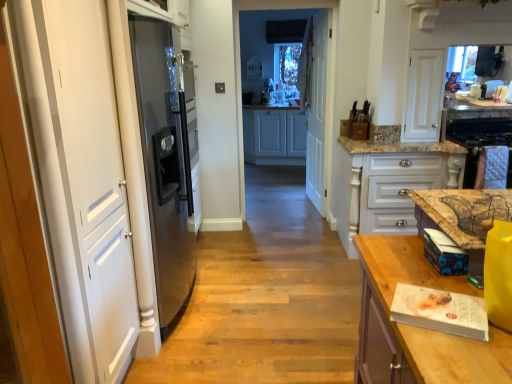
Question: Does white wood cabinets at center, which appears as the 2th cabinetry when viewed from the front, appear on the right side of brown marble countertop at right, the 1th countertop positioned from the top?

Choices:
 (A) yes
 (B) no

Answer: (B)

Question: Is white wood cabinets at center, the first cabinetry viewed from the left, touching brown marble countertop at right, which is the 2th countertop in bottom-to-top order?

Choices:
 (A) yes
 (B) no

Answer: (B)

Question: Considering the relative sizes of white wood cabinets at center, the first cabinetry viewed from the left, and brown marble countertop at right, the 1th countertop positioned from the top, in the image provided, is white wood cabinets at center, the first cabinetry viewed from the left, thinner than brown marble countertop at right, the 1th countertop positioned from the top,?

Choices:
 (A) yes
 (B) no

Answer: (B)

Question: Is white wood cabinets at center, which appears as the second cabinetry when viewed from the right, oriented towards brown marble countertop at right, the 1th countertop positioned from the top?

Choices:
 (A) yes
 (B) no

Answer: (A)

Question: Does white wood cabinets at center, which appears as the first cabinetry when viewed from the back, come behind brown marble countertop at right, which is the 2th countertop in bottom-to-top order?

Choices:
 (A) no
 (B) yes

Answer: (B)

Question: Does white wood cabinets at center, the first cabinetry in the top-to-bottom sequence, have a greater height compared to brown marble countertop at right, the 1th countertop positioned from the top?

Choices:
 (A) no
 (B) yes

Answer: (B)

Question: Does white glossy cabinet at center, the 2th cabinetry positioned from the top, appear on the left side of quilted fabric oven at right?

Choices:
 (A) no
 (B) yes

Answer: (B)

Question: Does white glossy cabinet at center, the 2th cabinetry positioned from the top, have a greater width compared to quilted fabric oven at right?

Choices:
 (A) yes
 (B) no

Answer: (A)

Question: Is white glossy cabinet at center, the first cabinetry positioned from the right, further to the viewer compared to quilted fabric oven at right?

Choices:
 (A) yes
 (B) no

Answer: (A)

Question: Does white glossy cabinet at center, arranged as the first cabinetry when ordered from the bottom, have a lesser height compared to quilted fabric oven at right?

Choices:
 (A) no
 (B) yes

Answer: (A)

Question: Is white glossy cabinet at center, the first cabinetry positioned from the right, next to quilted fabric oven at right and touching it?

Choices:
 (A) yes
 (B) no

Answer: (B)

Question: Is white glossy cabinet at center, which appears as the second cabinetry when viewed from the back, oriented towards quilted fabric oven at right?

Choices:
 (A) yes
 (B) no

Answer: (B)

Question: From a real-world perspective, is quilted fabric oven at right physically below white wood cabinets at center, which appears as the second cabinetry when viewed from the right?

Choices:
 (A) no
 (B) yes

Answer: (A)